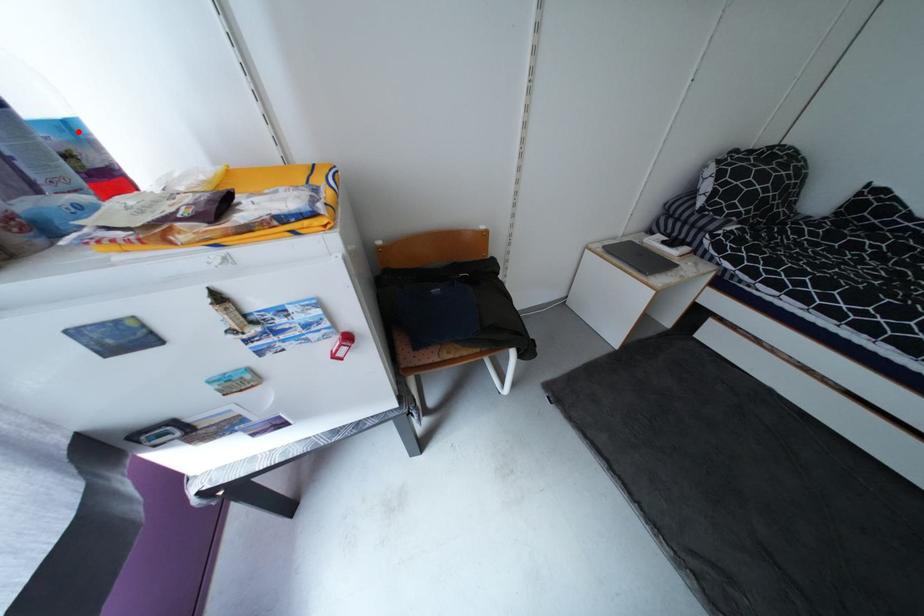
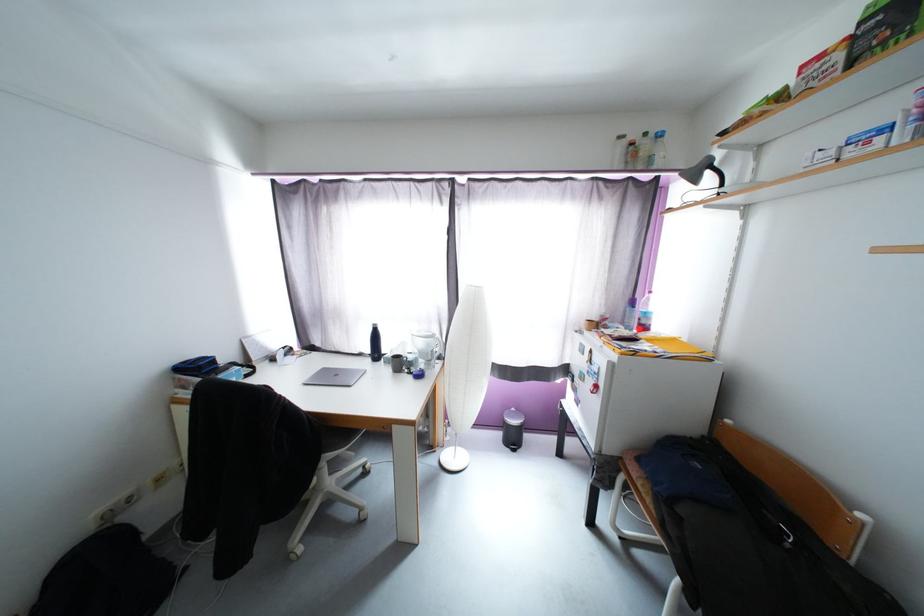
Find the pixel in the second image that matches the highlighted location in the first image.

(651, 315)